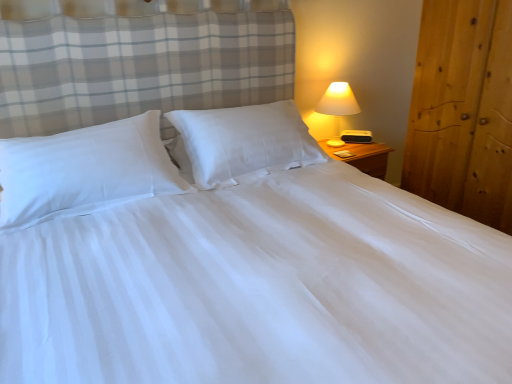
Describe the element at coordinates (241, 142) in the screenshot. I see `white smooth pillow at center, which is the 2th pillow from left to right` at that location.

In order to face wooden wardrobe at right, should I rotate leftwards or rightwards?

You should rotate right by 29.047 degrees.

Find the location of a particular element. matte white lamp at right is located at coordinates (338, 107).

Where is `white smooth pillow at center, which is the 2th pillow from left to right`? white smooth pillow at center, which is the 2th pillow from left to right is located at coordinates (241, 142).

Can you confirm if matte white lamp at right is thinner than wooden wardrobe at right?

Yes, matte white lamp at right is thinner than wooden wardrobe at right.

Is matte white lamp at right far from wooden wardrobe at right?

No.

From their relative heights in the image, would you say matte white lamp at right is taller or shorter than wooden wardrobe at right?

matte white lamp at right is shorter than wooden wardrobe at right.

Does wooden wardrobe at right have a larger size compared to matte white lamp at right?

Correct, wooden wardrobe at right is larger in size than matte white lamp at right.

How much distance is there between wooden wardrobe at right and matte white lamp at right?

wooden wardrobe at right and matte white lamp at right are 62.16 centimeters apart from each other.

Does point (448, 75) lie in front of point (346, 93)?

Yes, point (448, 75) is closer to viewer.

In the image, there is a wooden wardrobe at right. At what (x,y) coordinates should I click in order to perform the action: click on lamp above it (from the image's perspective). Please return your answer as a coordinate pair (x, y). Looking at the image, I should click on (338, 107).

Between matte white lamp at right and white smooth pillow at center, which is the 2th pillow from left to right, which one appears on the left side from the viewer's perspective?

white smooth pillow at center, which is the 2th pillow from left to right.

Is matte white lamp at right surrounding white smooth pillow at center, positioned as the 1th pillow in right-to-left order?

No, matte white lamp at right does not contain white smooth pillow at center, positioned as the 1th pillow in right-to-left order.

Does matte white lamp at right have a larger size compared to white smooth pillow at center, which is the 2th pillow from left to right?

Actually, matte white lamp at right might be smaller than white smooth pillow at center, which is the 2th pillow from left to right.

Does wooden wardrobe at right lie behind white smooth pillow at center, which is the 2th pillow from left to right?

No, the depth of wooden wardrobe at right is less than that of white smooth pillow at center, which is the 2th pillow from left to right.

From a real-world perspective, between wooden wardrobe at right and white smooth pillow at center, positioned as the 1th pillow in right-to-left order, who is vertically higher?

white smooth pillow at center, positioned as the 1th pillow in right-to-left order, is physically above.

Could you tell me if wooden wardrobe at right is facing white smooth pillow at center, positioned as the 1th pillow in right-to-left order?

Yes, wooden wardrobe at right is facing white smooth pillow at center, positioned as the 1th pillow in right-to-left order.

Is white smooth pillow at center, positioned as the 1th pillow in right-to-left order, oriented away from wooden wardrobe at right?

white smooth pillow at center, positioned as the 1th pillow in right-to-left order, does not have its back to wooden wardrobe at right.

From a real-world perspective, is white smooth pillow at center, which is the 2th pillow from left to right, positioned above or below wooden wardrobe at right?

In terms of real-world spatial position, white smooth pillow at center, which is the 2th pillow from left to right, is above wooden wardrobe at right.

Which object is thinner, white smooth pillow at center, which is the 2th pillow from left to right, or wooden wardrobe at right?

Thinner between the two is white smooth pillow at center, which is the 2th pillow from left to right.

Considering the relative sizes of white smooth pillow at left, which appears as the first pillow when viewed from the left, and white smooth pillow at center, which is the 2th pillow from left to right, in the image provided, is white smooth pillow at left, which appears as the first pillow when viewed from the left, shorter than white smooth pillow at center, which is the 2th pillow from left to right,?

Yes, white smooth pillow at left, which appears as the first pillow when viewed from the left, is shorter than white smooth pillow at center, which is the 2th pillow from left to right.

Is white smooth pillow at left, which appears as the first pillow when viewed from the left, not close to white smooth pillow at center, positioned as the 1th pillow in right-to-left order?

white smooth pillow at left, which appears as the first pillow when viewed from the left, is actually quite close to white smooth pillow at center, positioned as the 1th pillow in right-to-left order.

Which object is positioned more to the right, white smooth pillow at left, which appears as the first pillow when viewed from the left, or white smooth pillow at center, positioned as the 1th pillow in right-to-left order?

Positioned to the right is white smooth pillow at center, positioned as the 1th pillow in right-to-left order.

Between point (136, 157) and point (291, 113), which one is positioned in front?

The point (136, 157) is closer to the camera.

This screenshot has width=512, height=384. I want to click on the 2nd pillow positioned above the matte white lamp at right (from a real-world perspective), so click(x=84, y=170).

Looking at this image, from the image's perspective, does matte white lamp at right appear higher than white smooth pillow at left, which appears as the first pillow when viewed from the left?

Correct, matte white lamp at right appears higher than white smooth pillow at left, which appears as the first pillow when viewed from the left, in the image.

Does point (337, 112) come farther from viewer compared to point (67, 168)?

Yes, point (337, 112) is farther from viewer.

Can you tell me how much matte white lamp at right and white smooth pillow at left, acting as the second pillow starting from the right, differ in facing direction?

The facing directions of matte white lamp at right and white smooth pillow at left, acting as the second pillow starting from the right, are 2.98e-05 degrees apart.

You are a GUI agent. You are given a task and a screenshot of the screen. Output one action in this format:
    pyautogui.click(x=<x>, y=<y>)
    Task: Click on the lamp located above the wooden wardrobe at right (from the image's perspective)
    This screenshot has width=512, height=384.
    Given the screenshot: What is the action you would take?
    pyautogui.click(x=338, y=107)

The image size is (512, 384). In order to click on armoire below the matte white lamp at right (from the image's perspective) in this screenshot , I will do `click(463, 110)`.

Based on their spatial positions, is white smooth pillow at left, which appears as the first pillow when viewed from the left, or wooden wardrobe at right closer to white smooth pillow at center, which is the 2th pillow from left to right?

Among the two, white smooth pillow at left, which appears as the first pillow when viewed from the left, is located nearer to white smooth pillow at center, which is the 2th pillow from left to right.

Considering their positions, is white smooth pillow at center, positioned as the 1th pillow in right-to-left order, positioned further to matte white lamp at right than white smooth pillow at left, acting as the second pillow starting from the right?

white smooth pillow at left, acting as the second pillow starting from the right, lies further to matte white lamp at right than the other object.

Based on their spatial positions, is white smooth pillow at center, positioned as the 1th pillow in right-to-left order, or wooden wardrobe at right closer to matte white lamp at right?

wooden wardrobe at right lies closer to matte white lamp at right than the other object.

Based on their spatial positions, is white smooth pillow at center, which is the 2th pillow from left to right, or white smooth pillow at left, which appears as the first pillow when viewed from the left, further from wooden wardrobe at right?

white smooth pillow at left, which appears as the first pillow when viewed from the left, is further to wooden wardrobe at right.

Which object lies nearer to the anchor point white smooth pillow at left, acting as the second pillow starting from the right, white smooth pillow at center, positioned as the 1th pillow in right-to-left order, or wooden wardrobe at right?

Based on the image, white smooth pillow at center, positioned as the 1th pillow in right-to-left order, appears to be nearer to white smooth pillow at left, acting as the second pillow starting from the right.

Which object lies nearer to the anchor point white smooth pillow at center, positioned as the 1th pillow in right-to-left order, matte white lamp at right or white smooth pillow at left, acting as the second pillow starting from the right?

white smooth pillow at left, acting as the second pillow starting from the right, is closer to white smooth pillow at center, positioned as the 1th pillow in right-to-left order.

When comparing their distances from wooden wardrobe at right, does white smooth pillow at left, which appears as the first pillow when viewed from the left, or white smooth pillow at center, positioned as the 1th pillow in right-to-left order, seem further?

The object further to wooden wardrobe at right is white smooth pillow at left, which appears as the first pillow when viewed from the left.

Which object lies further to the anchor point white smooth pillow at left, which appears as the first pillow when viewed from the left, white smooth pillow at center, which is the 2th pillow from left to right, or matte white lamp at right?

Based on the image, matte white lamp at right appears to be further to white smooth pillow at left, which appears as the first pillow when viewed from the left.

Where is `lamp between white smooth pillow at center, which is the 2th pillow from left to right, and wooden wardrobe at right from left to right`? Image resolution: width=512 pixels, height=384 pixels. lamp between white smooth pillow at center, which is the 2th pillow from left to right, and wooden wardrobe at right from left to right is located at coordinates (338, 107).

Find the location of a particular element. Image resolution: width=512 pixels, height=384 pixels. pillow between white smooth pillow at left, acting as the second pillow starting from the right, and wooden wardrobe at right from left to right is located at coordinates tap(241, 142).

Where is `lamp between white smooth pillow at left, which appears as the first pillow when viewed from the left, and wooden wardrobe at right, in the horizontal direction`? lamp between white smooth pillow at left, which appears as the first pillow when viewed from the left, and wooden wardrobe at right, in the horizontal direction is located at coordinates (338, 107).

Image resolution: width=512 pixels, height=384 pixels. I want to click on pillow situated between white smooth pillow at left, acting as the second pillow starting from the right, and matte white lamp at right from left to right, so click(x=241, y=142).